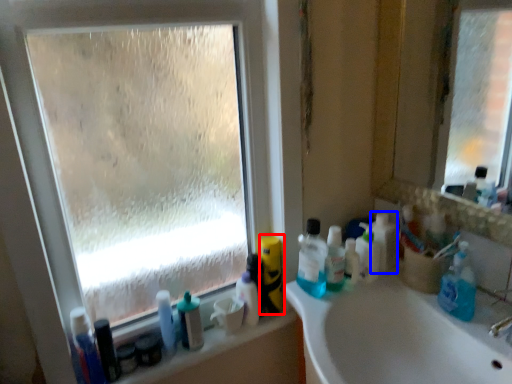
Question: Which of the following is the closest to the observer, cleaning product (highlighted by a red box) or toiletry (highlighted by a blue box)?

Choices:
 (A) cleaning product
 (B) toiletry

Answer: (B)